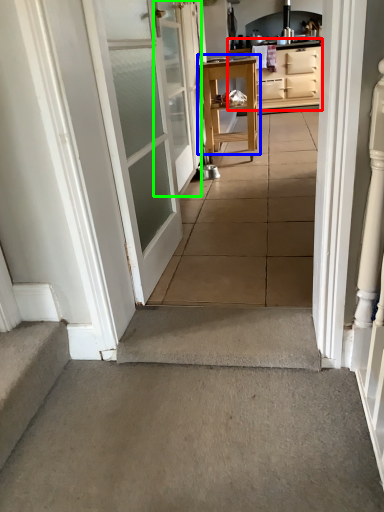
Question: Based on their relative distances, which object is farther from cabinetry (highlighted by a red box)? Choose from table (highlighted by a blue box) and door (highlighted by a green box).

Choices:
 (A) table
 (B) door

Answer: (B)